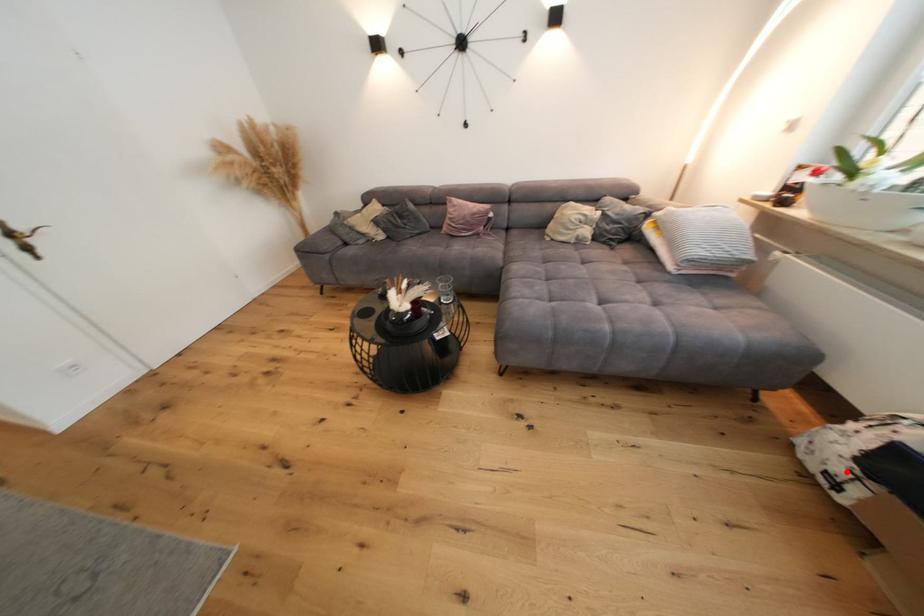
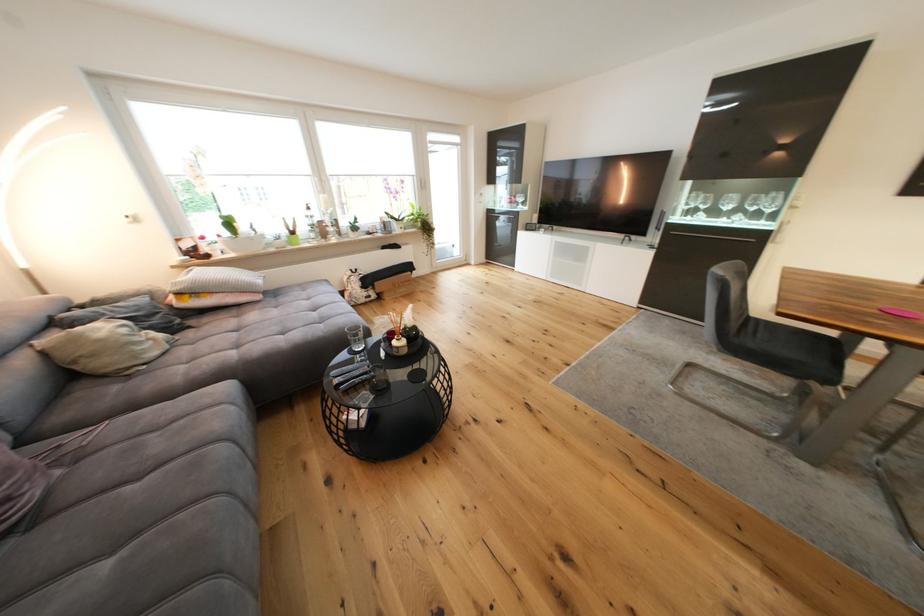
Question: I am providing you with two images of the same scene from different viewpoints. A red point is marked on the first image. At the location where the point appears in image 1, is it still visible in image 2?

Choices:
 (A) Yes
 (B) No

Answer: (A)